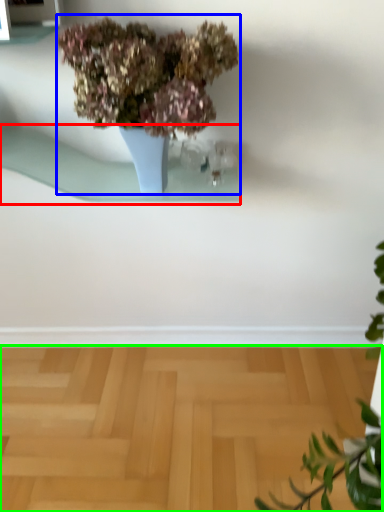
Question: Estimate the real-world distances between objects in this image. Which object is closer to window sill (highlighted by a red box), houseplant (highlighted by a blue box) or surface (highlighted by a green box)?

Choices:
 (A) houseplant
 (B) surface

Answer: (A)